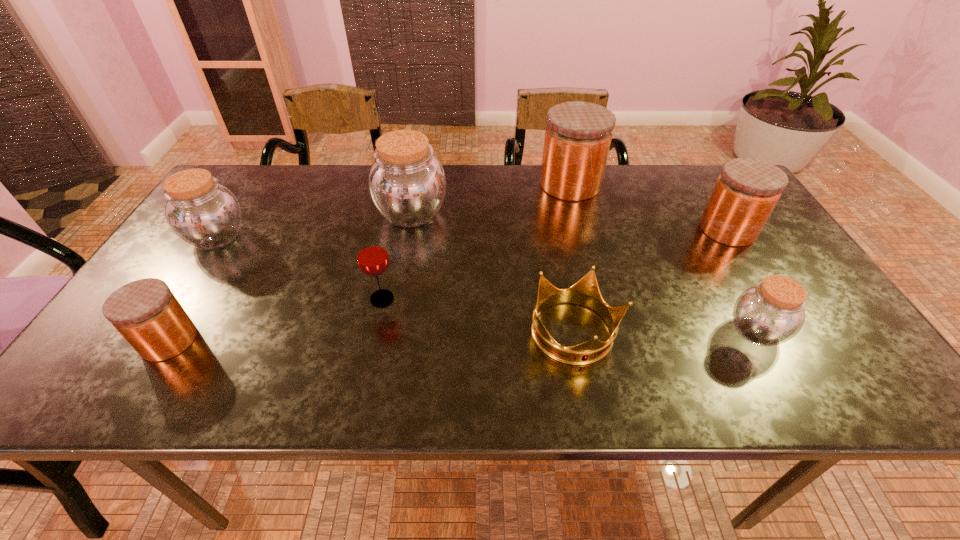
Find the location of a particular element. jar that can be found as the fifth closest to the leftmost brown jar is located at coordinates (747, 190).

This screenshot has width=960, height=540. Find the location of `jar that is the third closest to the second orange jar from right to left`. jar that is the third closest to the second orange jar from right to left is located at coordinates (770, 313).

Find the location of a particular element. the third closest orange jar relative to the crown is located at coordinates (145, 312).

I want to click on orange jar that is the closest one to the second biggest orange jar, so click(x=578, y=135).

You are a GUI agent. You are given a task and a screenshot of the screen. Output one action in this format:
    pyautogui.click(x=<x>, y=<y>)
    Task: Click on the brown jar that can be found as the closest to the nearest brown jar
    This screenshot has width=960, height=540.
    Given the screenshot: What is the action you would take?
    pyautogui.click(x=407, y=184)

Locate an element on the screen. the closest brown jar to the fourth jar from left to right is located at coordinates (407, 184).

Find the location of a particular element. blank area in the image that satisfies the following two spatial constraints: 1. on the front side of the fourth jar from right to left; 2. on the right side of the gold crown is located at coordinates (390, 333).

This screenshot has width=960, height=540. Identify the location of vacant region that satisfies the following two spatial constraints: 1. on the back side of the third jar from right to left; 2. on the right side of the fourth jar from right to left. (417, 185).

Locate an element on the screen. The height and width of the screenshot is (540, 960). free space that satisfies the following two spatial constraints: 1. on the front side of the shortest object; 2. on the left side of the second brown jar from right to left is located at coordinates (390, 333).

I want to click on vacant area in the image that satisfies the following two spatial constraints: 1. on the front side of the rightmost orange jar; 2. on the right side of the third jar from left to right, so (x=409, y=230).